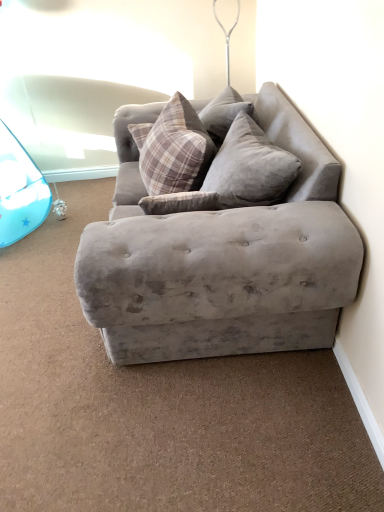
Question: From a real-world perspective, is velvet gray couch at center physically located above or below plaid fabric pillow at upper center, the first pillow from the left?

Choices:
 (A) above
 (B) below

Answer: (B)

Question: Does point (130, 356) appear closer or farther from the camera than point (147, 183)?

Choices:
 (A) farther
 (B) closer

Answer: (B)

Question: Which object is positioned closest to the plaid fabric pillow at upper center, which ranks as the 2th pillow in right-to-left order?

Choices:
 (A) velvet gray pillow at center, positioned as the first pillow in right-to-left order
 (B) velvet gray couch at center

Answer: (A)

Question: Estimate the real-world distances between objects in this image. Which object is farther from the velvet gray pillow at center, acting as the second pillow starting from the left?

Choices:
 (A) velvet gray couch at center
 (B) plaid fabric pillow at upper center, the first pillow from the left

Answer: (A)